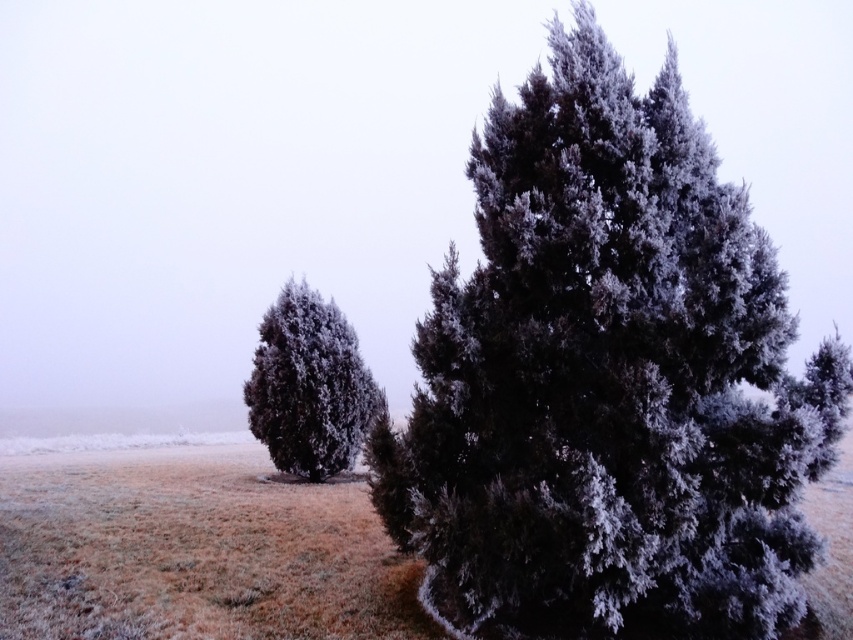
Question: Which point appears farthest from the camera in this image?

Choices:
 (A) (583, 410)
 (B) (293, 461)

Answer: (B)

Question: Does frosted dark green tree at center appear on the right side of frosted dark green tree at left?

Choices:
 (A) no
 (B) yes

Answer: (B)

Question: Can you confirm if frosted dark green tree at center is positioned to the right of frosted dark green tree at left?

Choices:
 (A) yes
 (B) no

Answer: (A)

Question: Among these points, which one is nearest to the camera?

Choices:
 (A) (337, 387)
 (B) (642, 596)

Answer: (B)

Question: Considering the relative positions of frosted dark green tree at center and frosted dark green tree at left in the image provided, where is frosted dark green tree at center located with respect to frosted dark green tree at left?

Choices:
 (A) left
 (B) right

Answer: (B)

Question: Among these points, which one is farthest from the camera?

Choices:
 (A) (514, 612)
 (B) (258, 397)

Answer: (B)